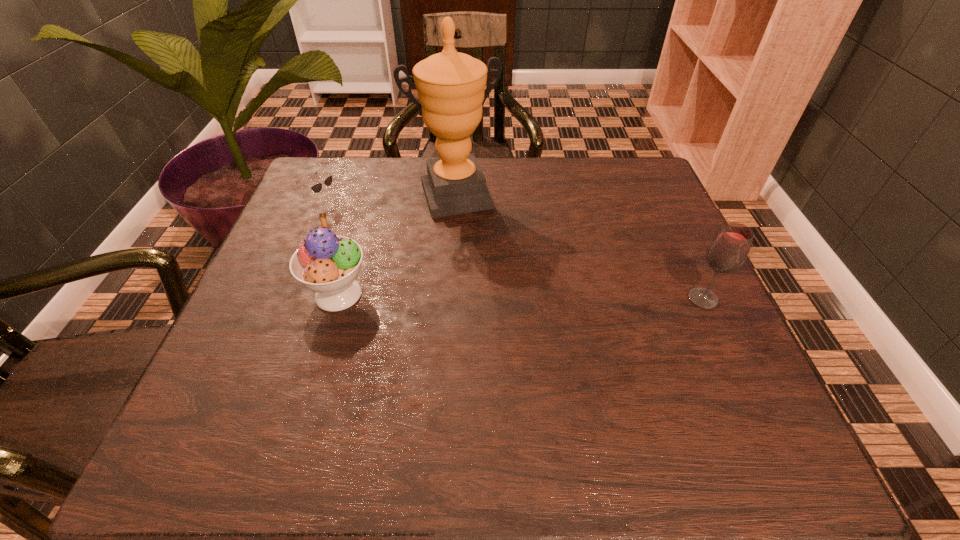
The width and height of the screenshot is (960, 540). In order to click on vacant region at the near edge of the desktop in this screenshot , I will do `click(348, 390)`.

At what (x,y) coordinates should I click in order to perform the action: click on vacant space at the left edge. Please return your answer as a coordinate pair (x, y). The image size is (960, 540). Looking at the image, I should click on (343, 215).

In order to click on free location at the right edge in this screenshot , I will do `click(692, 328)`.

You are a GUI agent. You are given a task and a screenshot of the screen. Output one action in this format:
    pyautogui.click(x=<x>, y=<y>)
    Task: Click on the vacant point at the far left corner
    The height and width of the screenshot is (540, 960).
    Given the screenshot: What is the action you would take?
    pyautogui.click(x=314, y=174)

In the image, there is a desktop. At what (x,y) coordinates should I click in order to perform the action: click on vacant space at the near left corner. Please return your answer as a coordinate pair (x, y). Image resolution: width=960 pixels, height=540 pixels. Looking at the image, I should click on (251, 368).

In the image, there is a desktop. Where is `vacant space at the far right corner`? The width and height of the screenshot is (960, 540). vacant space at the far right corner is located at coordinates (646, 177).

Locate an element on the screen. free space at the near right corner of the desktop is located at coordinates (723, 371).

This screenshot has width=960, height=540. Identify the location of unoccupied area between the second object from right to left and the glass drink container. (579, 247).

At what (x,y) coordinates should I click in order to perform the action: click on vacant space in between the rightmost object and the shortest object. Please return your answer as a coordinate pair (x, y). Image resolution: width=960 pixels, height=540 pixels. Looking at the image, I should click on (514, 251).

The image size is (960, 540). Identify the location of free space between the glass drink container and the shortest object. (514, 251).